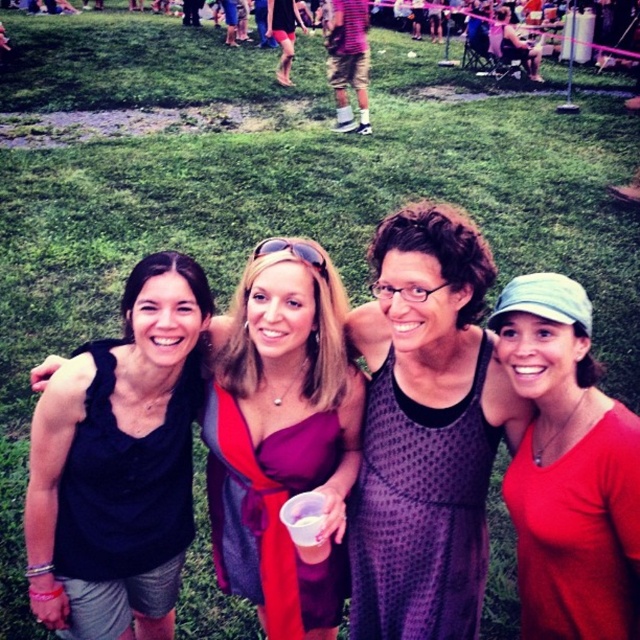
Question: Which object appears farthest from the camera in this image?

Choices:
 (A) purple mesh dress at center
 (B) burgundy satin dress at center
 (C) black fabric dress at center

Answer: (B)

Question: Can you confirm if black fabric dress at center is smaller than red matte shirt at center?

Choices:
 (A) no
 (B) yes

Answer: (A)

Question: Can you confirm if red matte shirt at center is wider than burgundy satin dress at center?

Choices:
 (A) yes
 (B) no

Answer: (B)

Question: Which object is farther from the camera taking this photo?

Choices:
 (A) burgundy satin dress at center
 (B) purple mesh dress at center

Answer: (A)

Question: Estimate the real-world distances between objects in this image. Which object is farther from the purple mesh dress at center?

Choices:
 (A) red matte shirt at center
 (B) black fabric dress at center

Answer: (A)

Question: Does black fabric dress at center have a smaller size compared to purple mesh dress at center?

Choices:
 (A) no
 (B) yes

Answer: (A)